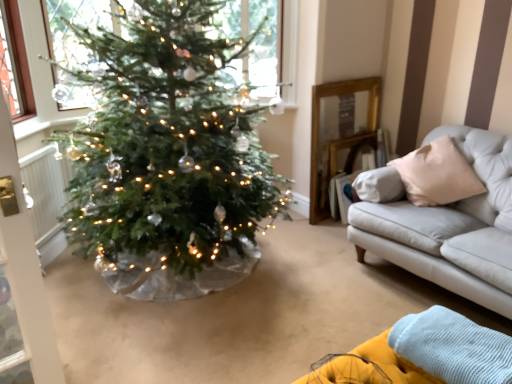
Question: Is yellow fabric couch at lower right bigger than white textured radiator at left?

Choices:
 (A) yes
 (B) no

Answer: (A)

Question: From a real-world perspective, is yellow fabric couch at lower right below white textured radiator at left?

Choices:
 (A) yes
 (B) no

Answer: (A)

Question: Can you confirm if yellow fabric couch at lower right is wider than white textured radiator at left?

Choices:
 (A) yes
 (B) no

Answer: (A)

Question: Is yellow fabric couch at lower right thinner than white textured radiator at left?

Choices:
 (A) no
 (B) yes

Answer: (A)

Question: Does yellow fabric couch at lower right have a lesser height compared to white textured radiator at left?

Choices:
 (A) yes
 (B) no

Answer: (A)

Question: Can you confirm if yellow fabric couch at lower right is positioned to the right of white textured radiator at left?

Choices:
 (A) yes
 (B) no

Answer: (A)

Question: Is yellow fabric couch at lower right oriented towards clear glass window at upper center?

Choices:
 (A) no
 (B) yes

Answer: (A)

Question: From a real-world perspective, is yellow fabric couch at lower right physically above clear glass window at upper center?

Choices:
 (A) no
 (B) yes

Answer: (A)

Question: Can you confirm if yellow fabric couch at lower right is wider than clear glass window at upper center?

Choices:
 (A) yes
 (B) no

Answer: (A)

Question: From the image's perspective, is yellow fabric couch at lower right on clear glass window at upper center?

Choices:
 (A) yes
 (B) no

Answer: (B)

Question: Is yellow fabric couch at lower right located outside clear glass window at upper center?

Choices:
 (A) no
 (B) yes

Answer: (B)

Question: Does yellow fabric couch at lower right have a lesser height compared to clear glass window at upper center?

Choices:
 (A) no
 (B) yes

Answer: (B)

Question: Is white textured radiator at left aimed at yellow fabric couch at lower right?

Choices:
 (A) no
 (B) yes

Answer: (A)